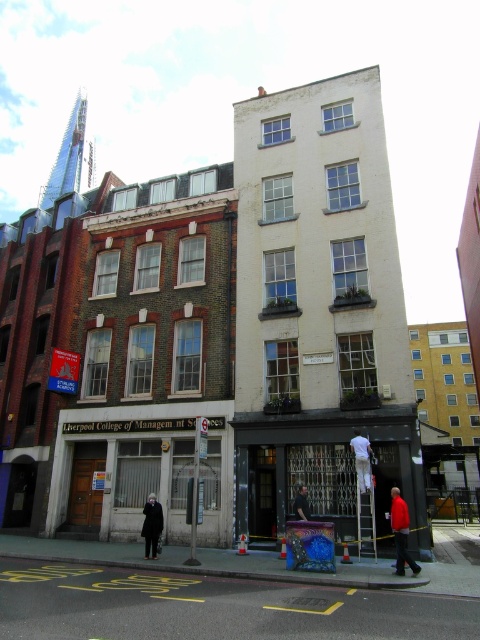
Find the location of a particular element. red cotton shirt at lower right is located at coordinates (400, 532).

Is red cotton shirt at lower right above black wool coat at center?

Correct, red cotton shirt at lower right is located above black wool coat at center.

Describe the element at coordinates (400, 532) in the screenshot. Image resolution: width=480 pixels, height=640 pixels. I see `red cotton shirt at lower right` at that location.

Locate an element on the screen. red cotton shirt at lower right is located at coordinates (400, 532).

Does red cotton shirt at lower right have a smaller size compared to dark hair at center?

No.

Is red cotton shirt at lower right to the right of dark hair at center from the viewer's perspective?

Indeed, red cotton shirt at lower right is positioned on the right side of dark hair at center.

Locate an element on the screen. red cotton shirt at lower right is located at coordinates (400, 532).

Locate an element on the screen. This screenshot has height=640, width=480. red cotton shirt at lower right is located at coordinates (400, 532).

Which is in front, point (159, 532) or point (362, 454)?

Point (362, 454) is more forward.

Does point (145, 540) lie in front of point (372, 452)?

Yes, point (145, 540) is closer to viewer.

Identify the location of black wool coat at center. The width and height of the screenshot is (480, 640). (152, 524).